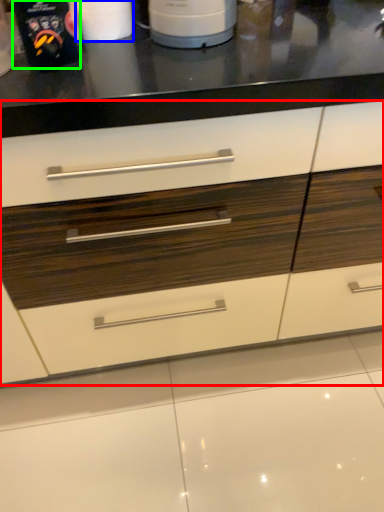
Question: Based on their relative distances, which object is farther from drawer (highlighted by a red box)? Choose from paper towel (highlighted by a blue box) and kitchen appliance (highlighted by a green box).

Choices:
 (A) paper towel
 (B) kitchen appliance

Answer: (A)